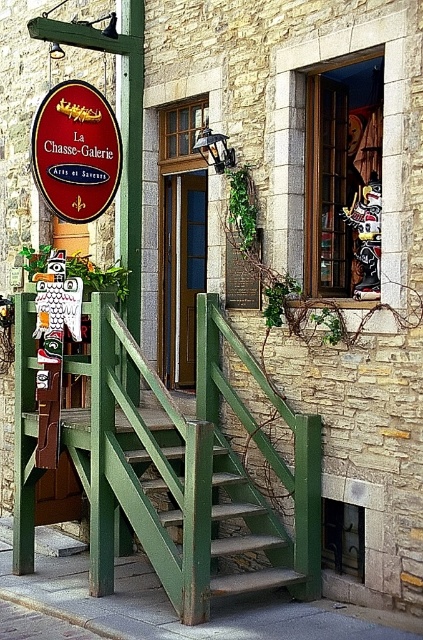
You are standing at the entrance of La Chasse Galerie and want to walk towards the point labeled as point [33,120]. However, there is an obstacle at point [109,388]. Can you safely walk around the obstacle to reach your destination?

Point [109,388] is in front of point [33,120], so the obstacle is blocking the direct path. You will need to navigate around it to reach your destination.

You are standing at the entrance of La Chasse Galerie and want to take a photo of the two points mentioned. Which point, point (175,552) or point (101,192), will appear larger in your photo?

Point (175,552) is closer to the camera than point (101,192), so it will appear larger in the photo.